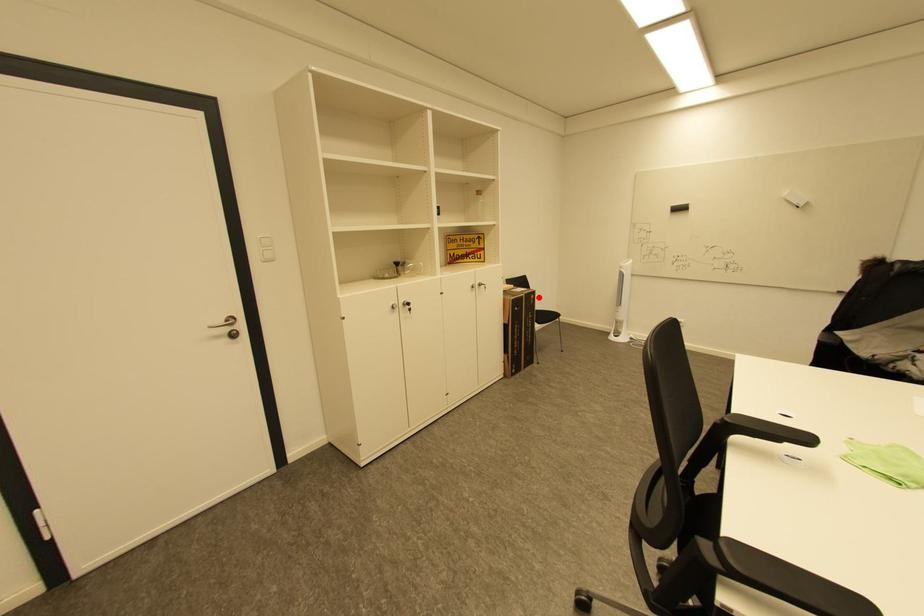
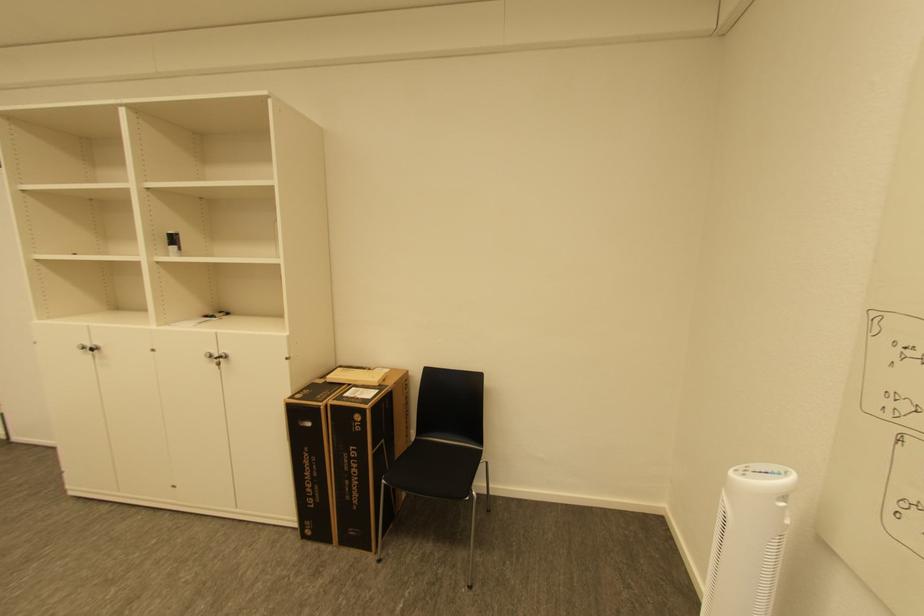
Find the pixel in the second image that matches the highlighted location in the first image.

(363, 418)